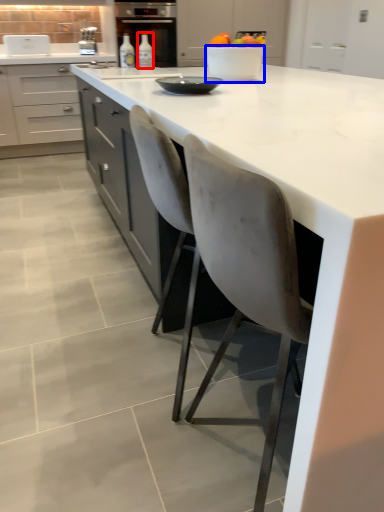
Question: Which object is closer to the camera taking this photo, bottle (highlighted by a red box) or bowl (highlighted by a blue box)?

Choices:
 (A) bottle
 (B) bowl

Answer: (B)